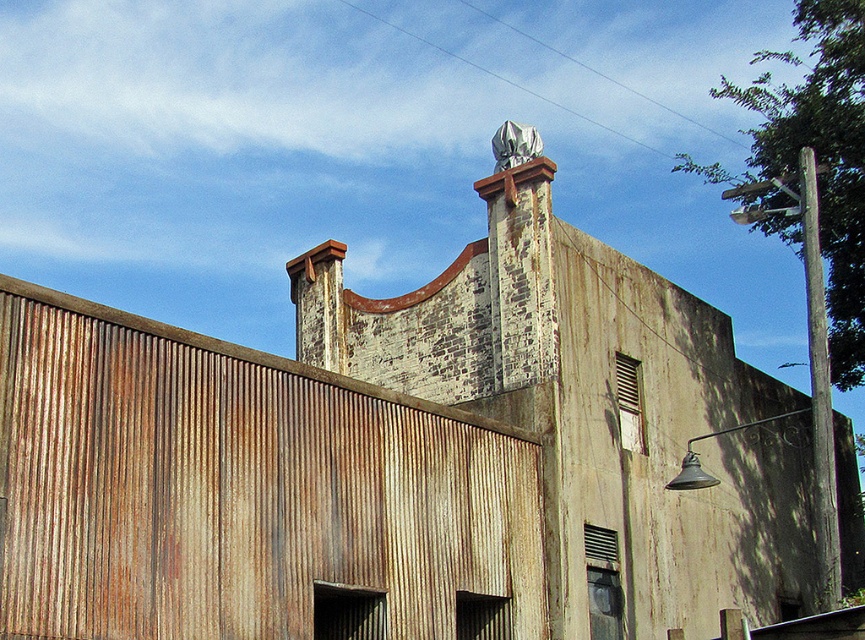
Question: Is rusty corrugated metal at center above white stone chimney at upper center?

Choices:
 (A) yes
 (B) no

Answer: (B)

Question: Can you confirm if rusty corrugated metal at center is smaller than white stone chimney at upper center?

Choices:
 (A) yes
 (B) no

Answer: (A)

Question: From the image, what is the correct spatial relationship of rusty corrugated metal at center in relation to white stone chimney at upper center?

Choices:
 (A) right
 (B) left

Answer: (B)

Question: Which object is farther from the camera taking this photo?

Choices:
 (A) rusty corrugated metal at center
 (B) white stone chimney at upper center

Answer: (B)

Question: Among these points, which one is nearest to the camera?

Choices:
 (A) (176, 532)
 (B) (453, 396)

Answer: (A)